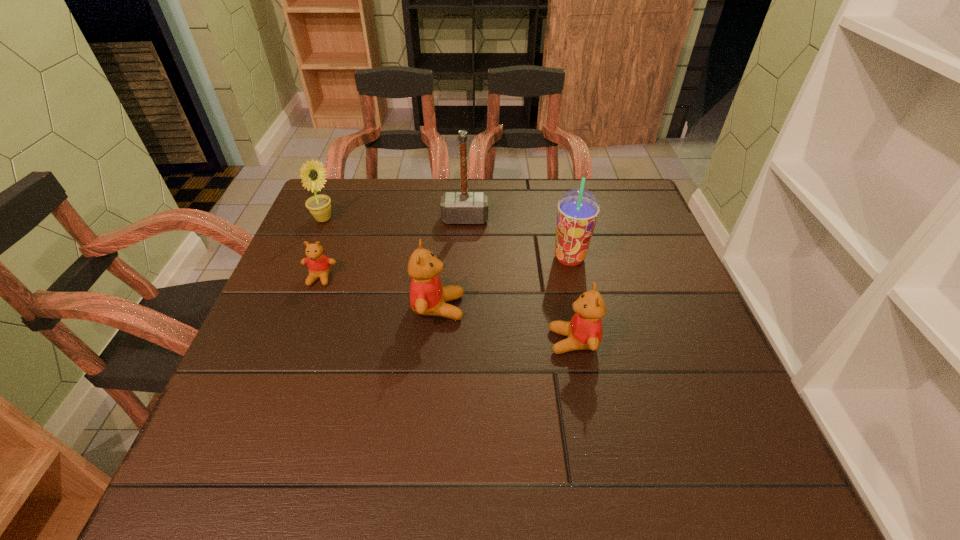
Find the location of `free point between the rightmost teddy bear and the sunflower`. free point between the rightmost teddy bear and the sunflower is located at coordinates (448, 280).

Locate an element on the screen. This screenshot has height=540, width=960. blank region between the second teddy bear from left to right and the hammer is located at coordinates (451, 263).

The width and height of the screenshot is (960, 540). What are the coordinates of `vacant space that's between the leftmost teddy bear and the hammer` in the screenshot? It's located at (393, 248).

Locate an element on the screen. This screenshot has height=540, width=960. free space between the smoothie and the second shortest object is located at coordinates tap(571, 300).

Identify the location of vacant area that lies between the hammer and the smoothie. (517, 239).

Identify the location of empty space between the hammer and the second shortest object. (519, 280).

The image size is (960, 540). Identify the location of vacant point located between the smoothie and the second teddy bear from right to left. (504, 282).

I want to click on vacant area that lies between the leftmost teddy bear and the second teddy bear from left to right, so click(x=379, y=293).

Identify which object is the nearest to the smoothie. Please provide its 2D coordinates. Your answer should be formatted as a tuple, i.e. [(x, y)], where the tuple contains the x and y coordinates of a point satisfying the conditions above.

[(584, 331)]

Image resolution: width=960 pixels, height=540 pixels. Find the location of `object that ranks as the fifth closest to the sunflower`. object that ranks as the fifth closest to the sunflower is located at coordinates (584, 331).